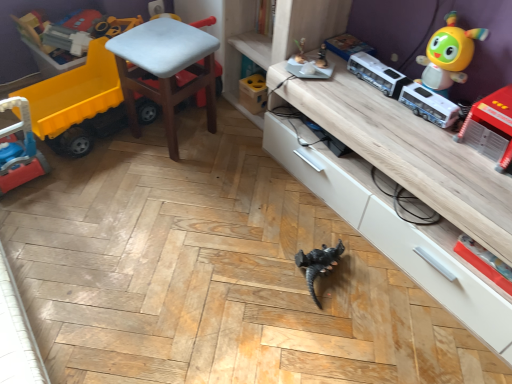
I want to click on empty space that is to the right of white plastic chair at center, so click(233, 146).